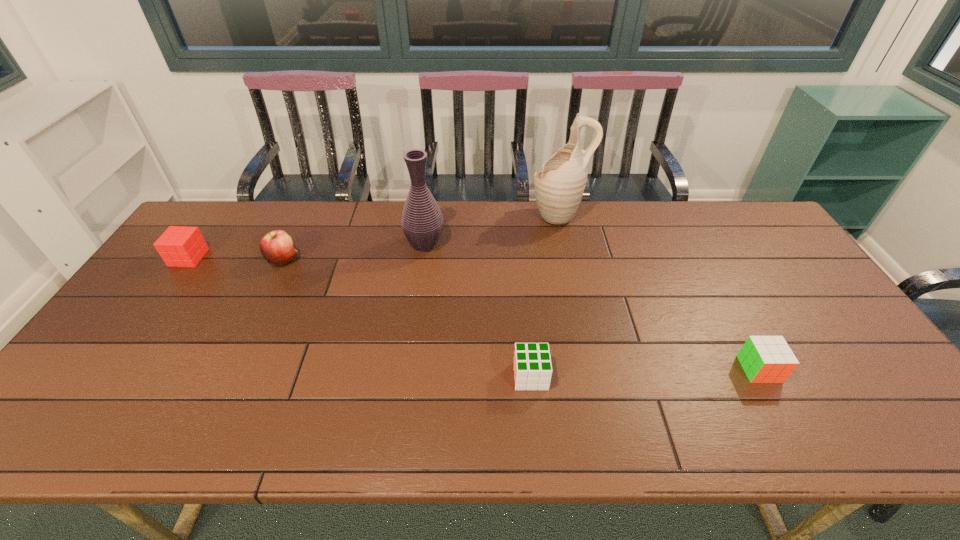
This screenshot has height=540, width=960. In order to click on blank space that satisfies the following two spatial constraints: 1. on the front side of the rightmost cube; 2. on the right side of the third object from left to right in this screenshot , I will do `click(408, 369)`.

Where is `free space that satisfies the following two spatial constraints: 1. on the front side of the leftmost object; 2. on the left side of the rightmost cube`? free space that satisfies the following two spatial constraints: 1. on the front side of the leftmost object; 2. on the left side of the rightmost cube is located at coordinates (109, 369).

Identify the location of free point that satisfies the following two spatial constraints: 1. at the spout of the farthest object; 2. on the front side of the farthest cube. (567, 258).

Locate an element on the screen. The width and height of the screenshot is (960, 540). vacant space that satisfies the following two spatial constraints: 1. at the spout of the rightmost cube; 2. on the left side of the second object from right to left is located at coordinates (591, 369).

Identify the location of free space that satisfies the following two spatial constraints: 1. at the spout of the rightmost object; 2. on the left side of the second object from right to left. The height and width of the screenshot is (540, 960). (591, 369).